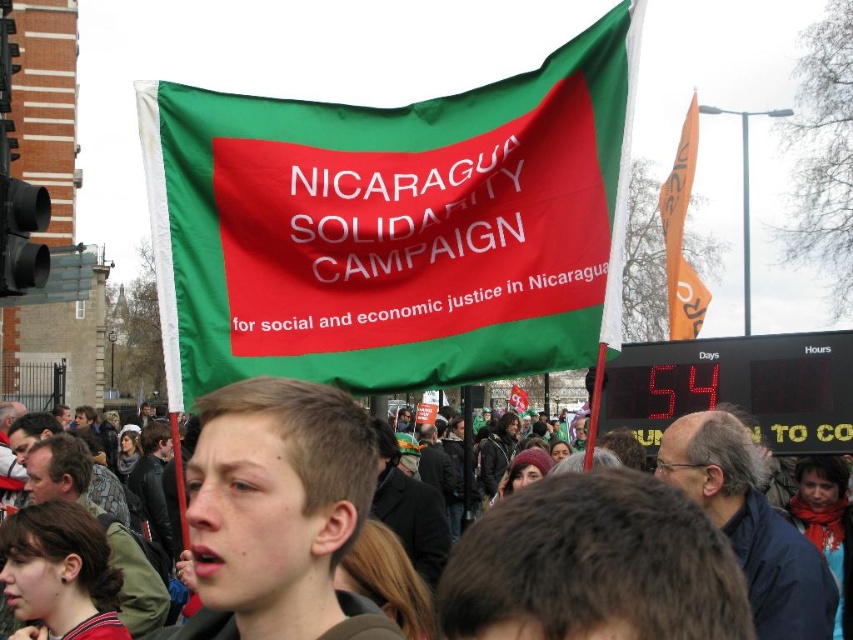
Does point (250, 572) lie in front of point (524, 410)?

Yes.

Between smooth brown hair at center and green fabric flag at upper center, which one is positioned lower?

Positioned lower is green fabric flag at upper center.

The image size is (853, 640). What do you see at coordinates (277, 512) in the screenshot?
I see `smooth brown hair at center` at bounding box center [277, 512].

At what (x,y) coordinates should I click in order to perform the action: click on smooth brown hair at center. Please return your answer as a coordinate pair (x, y). This screenshot has width=853, height=640. Looking at the image, I should click on (277, 512).

Can you confirm if green fabric flag at center is shorter than orange fabric flag at upper right?

Yes, green fabric flag at center is shorter than orange fabric flag at upper right.

Where is `green fabric flag at center`? Image resolution: width=853 pixels, height=640 pixels. green fabric flag at center is located at coordinates (393, 227).

Image resolution: width=853 pixels, height=640 pixels. In order to click on green fabric flag at center in this screenshot , I will do `click(393, 227)`.

Can you confirm if green fabric flag at center is positioned below smooth brown hair at center?

No, green fabric flag at center is not below smooth brown hair at center.

Who is positioned more to the right, green fabric flag at center or smooth brown hair at center?

smooth brown hair at center is more to the right.

Image resolution: width=853 pixels, height=640 pixels. I want to click on green fabric flag at center, so click(393, 227).